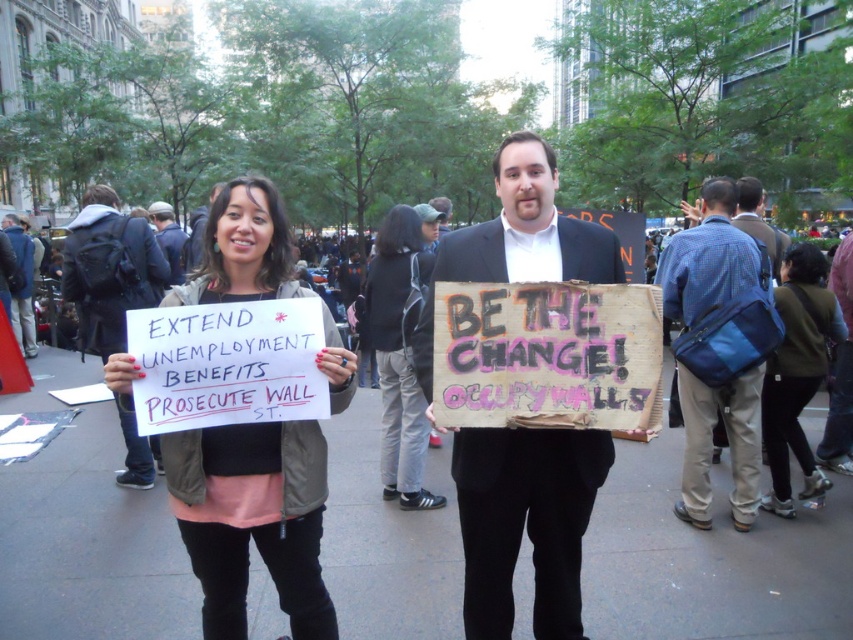
Question: Is wooden sign at center bigger than matte black sign at center?

Choices:
 (A) yes
 (B) no

Answer: (B)

Question: Which object appears closest to the camera in this image?

Choices:
 (A) light brown leather jacket at center
 (B) white cardboard sign at center

Answer: (B)

Question: Which object is closer to the camera taking this photo?

Choices:
 (A) black fabric jacket at center
 (B) blue fabric bag at right

Answer: (B)

Question: Estimate the real-world distances between objects in this image. Which object is farther from the white cardboard sign at center?

Choices:
 (A) light brown leather jacket at center
 (B) blue denim jacket at upper left

Answer: (A)

Question: Does light brown leather jacket at center appear on the right side of blue denim jacket at center?

Choices:
 (A) no
 (B) yes

Answer: (B)

Question: Does blue fabric bag at right have a larger size compared to black fabric jacket at center?

Choices:
 (A) no
 (B) yes

Answer: (A)